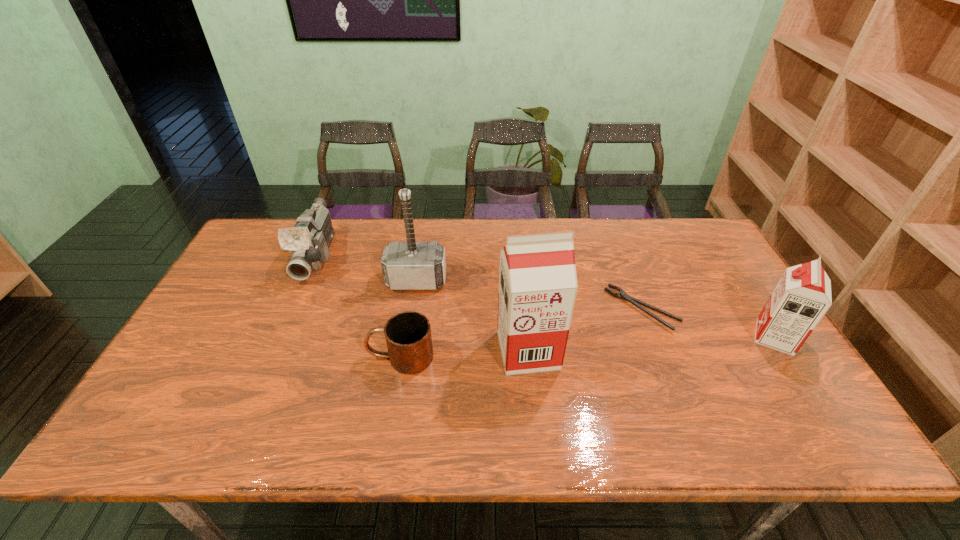
What are the coordinates of `vacant area that satisfies the following two spatial constraints: 1. on the front-facing side of the leftmost object; 2. on the right side of the tallest object` in the screenshot? It's located at (276, 350).

You are a GUI agent. You are given a task and a screenshot of the screen. Output one action in this format:
    pyautogui.click(x=<x>, y=<y>)
    Task: Click on the vacant area that satisfies the following two spatial constraints: 1. for striking with the head of the hammer; 2. on the side of the fifth tallest object with the handle
    This screenshot has height=540, width=960.
    Given the screenshot: What is the action you would take?
    pyautogui.click(x=405, y=357)